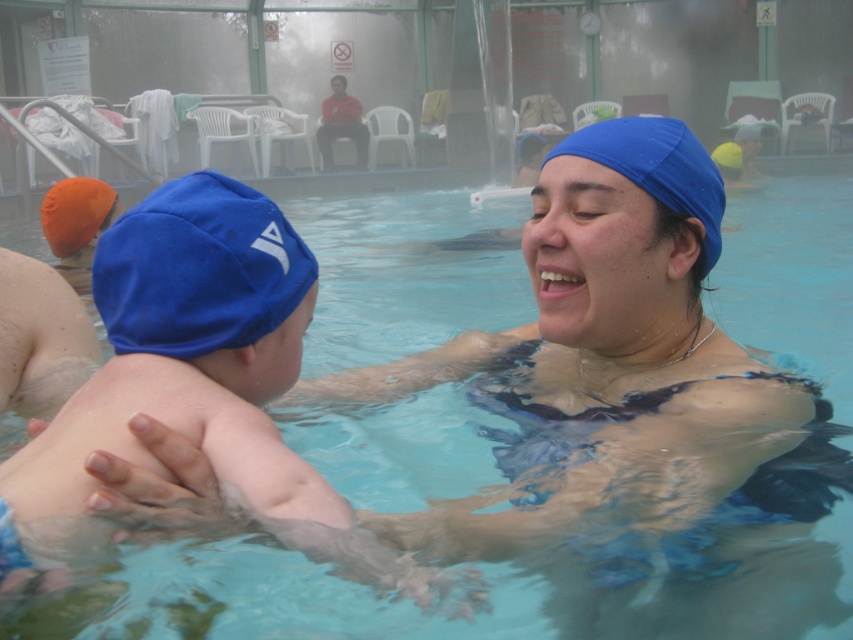
You are a lifeguard observing the pool area and notice two swim caps. Which swim cap is shorter in height between the blue fleece swim cap at left and the blue fabric swim cap at center?

The blue fleece swim cap at left has a lesser height compared to the blue fabric swim cap at center, so the blue fleece swim cap at left is shorter.

You are a lifeguard who needs to retrieve both swim caps from the pool. The blue fleece swim cap at left is 53.82 centimeters away from the blue fabric swim cap at center. If you start at the edge of the pool, which swim cap should you reach first to minimize the distance traveled?

The blue fleece swim cap at left is closer to the edge of the pool than the blue fabric swim cap at center since it is only 53.82 centimeters away from the latter. Therefore, you should reach the blue fleece swim cap at left first to minimize the distance traveled.

You are a photographer standing at the camera position. You want to take a photo of the blue fleece swim cap at left. Is the swim cap within the camera frame?

The blue fleece swim cap at left and camera are 33.76 inches apart from each other. Assuming a typical camera lens with a focal length that can capture objects within this distance, the swim cap should be within the frame as long as the camera is properly aimed.